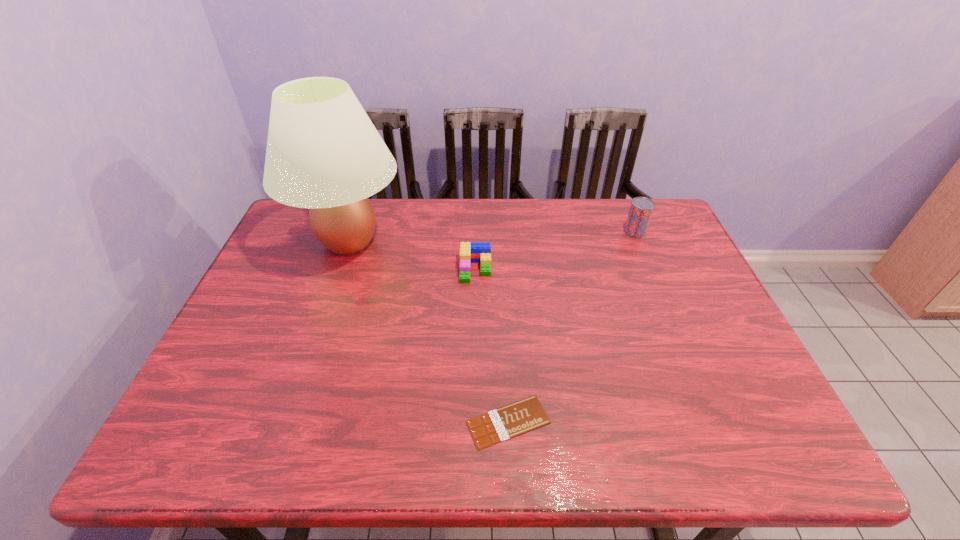
Image resolution: width=960 pixels, height=540 pixels. Identify the location of vacant space situated on the right of the shortest object. (645, 422).

At what (x,y) coordinates should I click in order to perform the action: click on lampshade that is at the far edge. Please return your answer as a coordinate pair (x, y). Looking at the image, I should click on (323, 152).

Locate an element on the screen. beer can present at the far edge is located at coordinates (641, 209).

The height and width of the screenshot is (540, 960). In order to click on object at the near edge in this screenshot , I will do `click(509, 421)`.

Find the location of a particular element. This screenshot has height=540, width=960. object positioned at the left edge is located at coordinates (323, 152).

Identify the location of object situated at the right edge. The width and height of the screenshot is (960, 540). (641, 209).

The height and width of the screenshot is (540, 960). Find the location of `object that is at the far left corner`. object that is at the far left corner is located at coordinates (323, 152).

I want to click on object located in the far right corner section of the desktop, so click(x=641, y=209).

Where is `vacant area at the far edge of the desktop`? vacant area at the far edge of the desktop is located at coordinates (429, 238).

Locate an element on the screen. Image resolution: width=960 pixels, height=540 pixels. free space at the near edge of the desktop is located at coordinates (352, 429).